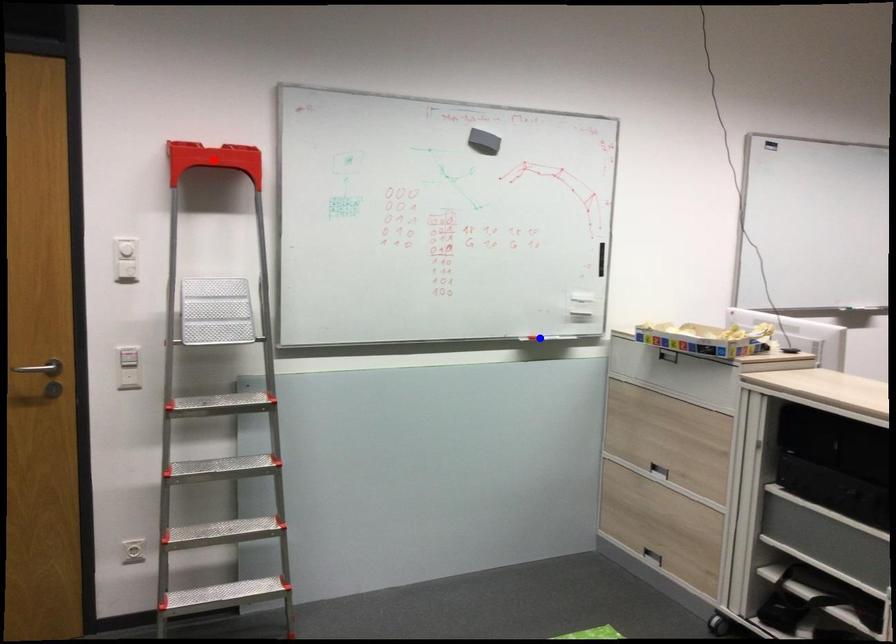
Question: Two points are marked on the image. Which point is closer to the camera?

Choices:
 (A) Blue point is closer.
 (B) Red point is closer.

Answer: (B)